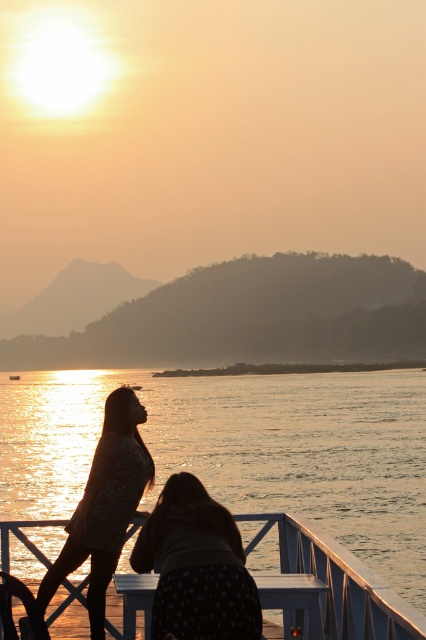
Which is below, polka dot fabric woman at lower center or white painted wood deck at lower center?

white painted wood deck at lower center

Can you confirm if polka dot fabric woman at lower center is shorter than white painted wood deck at lower center?

Incorrect, polka dot fabric woman at lower center's height does not fall short of white painted wood deck at lower center's.

Is point (178, 483) positioned before point (17, 536)?

Yes, it is in front of point (17, 536).

Locate an element on the screen. This screenshot has height=640, width=426. polka dot fabric woman at lower center is located at coordinates (196, 566).

Between polka dot fabric woman at lower center and silhouette floral dress at center, which one has less height?

With less height is polka dot fabric woman at lower center.

Is point (190, 547) behind point (120, 419)?

No, (190, 547) is closer to viewer.

Identify the location of polka dot fabric woman at lower center. This screenshot has height=640, width=426. (196, 566).

Is glistening water at lower center taller than silhouette floral dress at center?

Indeed, glistening water at lower center has a greater height compared to silhouette floral dress at center.

I want to click on glistening water at lower center, so click(x=241, y=449).

Is point (348, 410) positioned after point (144, 483)?

That is True.

Where is `glistening water at lower center`? The height and width of the screenshot is (640, 426). glistening water at lower center is located at coordinates (241, 449).